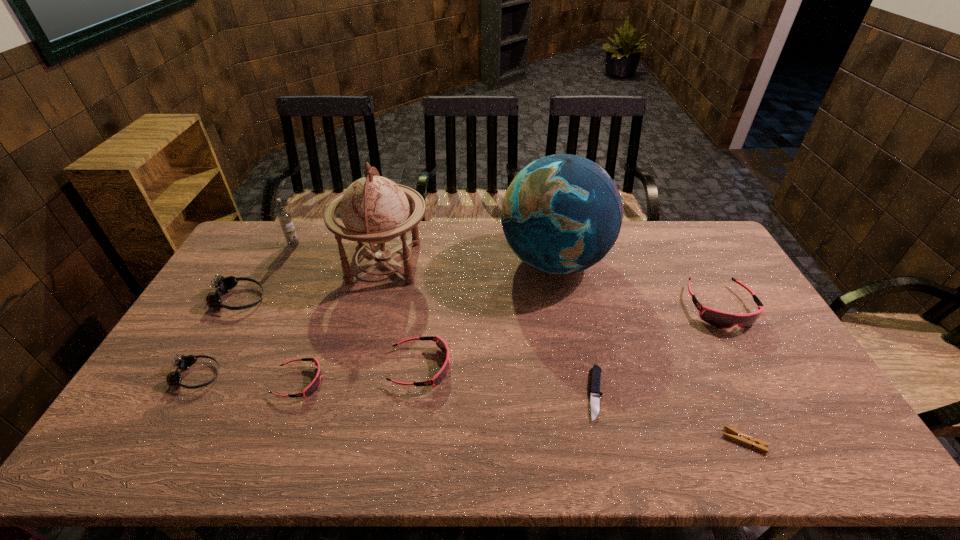
Where is `the right globe`? This screenshot has width=960, height=540. the right globe is located at coordinates (561, 214).

Where is `the left globe`? The height and width of the screenshot is (540, 960). the left globe is located at coordinates (375, 210).

Locate an element on the screen. vodka is located at coordinates (284, 217).

The height and width of the screenshot is (540, 960). In order to click on the farthest pink goggles in this screenshot , I will do point(724,320).

Where is `the rightmost pink goggles`? This screenshot has height=540, width=960. the rightmost pink goggles is located at coordinates (724, 320).

Locate an element on the screen. This screenshot has height=540, width=960. the farther bronze goggles is located at coordinates (224, 285).

Locate an element on the screen. the second biggest pink goggles is located at coordinates (441, 344).

I want to click on the fourth goggles from left to right, so click(x=441, y=344).

At what (x,y) coordinates should I click in order to perform the action: click on the nearer bronze goggles. Please return your answer as a coordinate pair (x, y). The width and height of the screenshot is (960, 540). Looking at the image, I should click on (183, 362).

At what (x,y) coordinates should I click in order to perform the action: click on the leftmost pink goggles. Please return your answer as a coordinate pair (x, y). This screenshot has width=960, height=540. Looking at the image, I should click on click(312, 388).